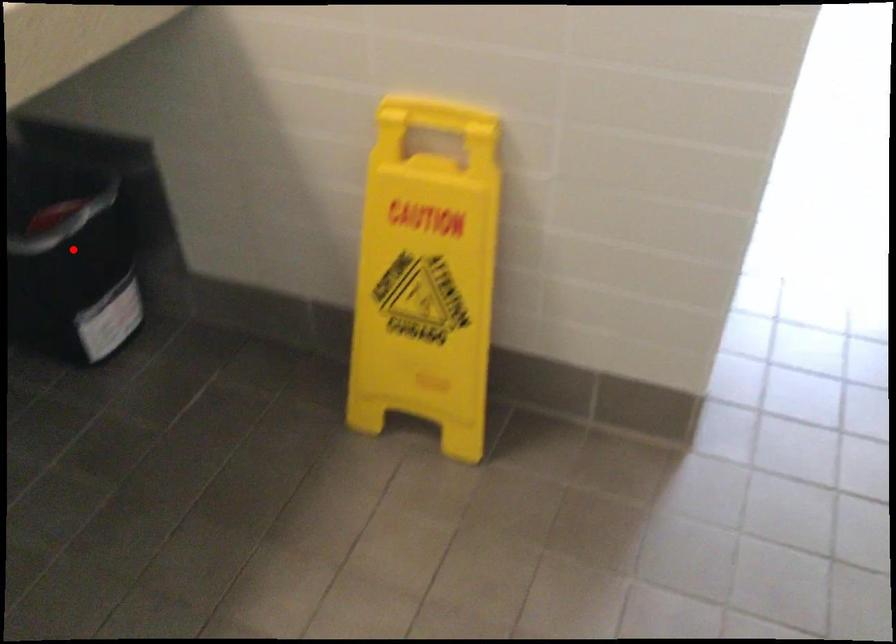
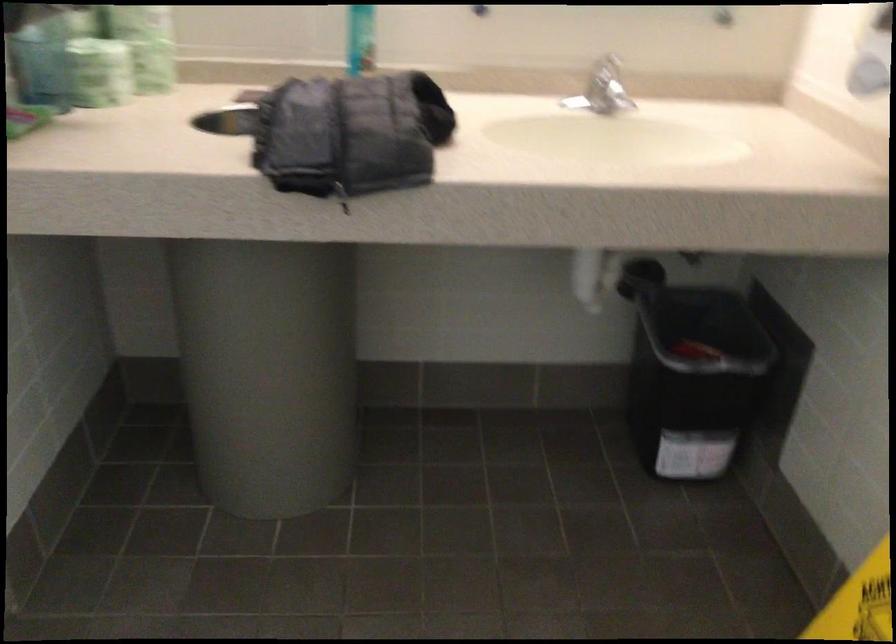
Where in the second image is the point corresponding to the highlighted location from the first image?

(691, 373)